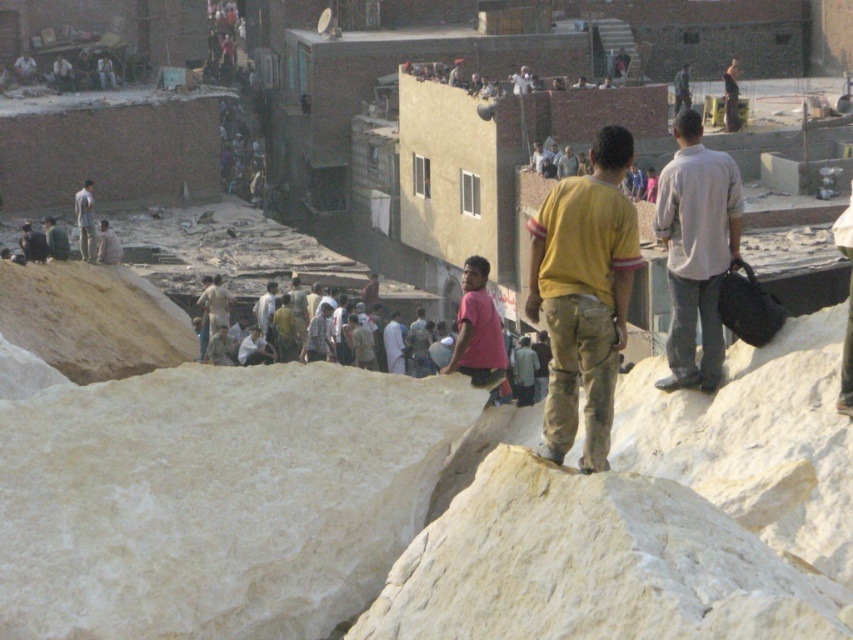
You are a photographer trying to capture both the yellow cotton shirt at center and the pink fabric shirt at center in the same frame. Which shirt should you focus on to ensure both are visible without needing to adjust your camera angle?

The yellow cotton shirt at center is much taller than the pink fabric shirt at center, so focusing on the yellow cotton shirt at center will ensure both are visible without needing to adjust your camera angle.

You are a fashion designer observing the urban scene. You notice two garments in the crowd. The first is a pink fabric shirt at center, and the second is a light brown leather jacket at upper left. Which garment appears taller when viewed from your perspective?

The pink fabric shirt at center appears taller than the light brown leather jacket at upper left because the pink fabric shirt at center has a greater height compared to light brown leather jacket at upper left.